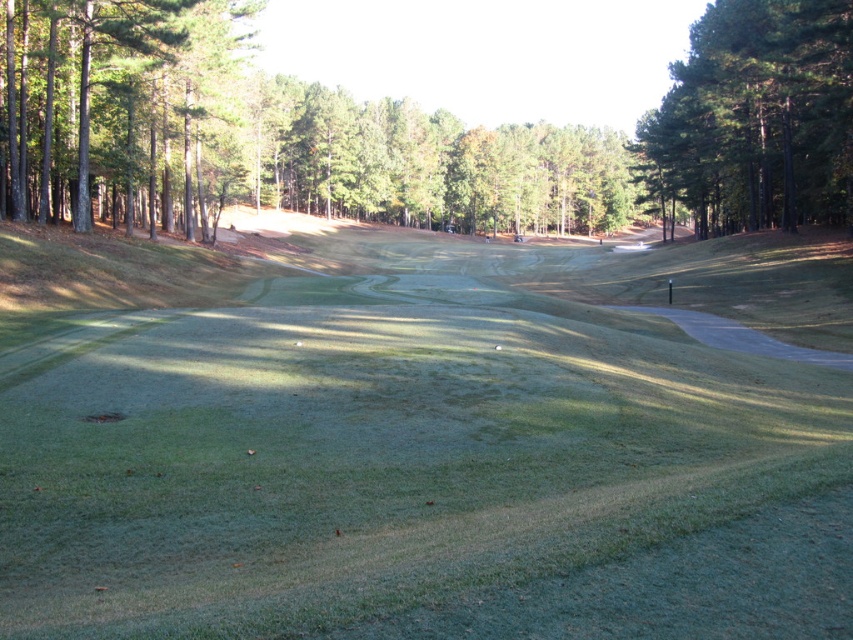
Question: Observing the image, what is the correct spatial positioning of green grassy field at center in reference to green textured tree at left?

Choices:
 (A) left
 (B) right

Answer: (B)

Question: Which point is closer to the camera?

Choices:
 (A) (39, 632)
 (B) (48, 88)
 (C) (838, 28)

Answer: (A)

Question: Among these points, which one is farthest from the camera?

Choices:
 (A) (42, 342)
 (B) (828, 90)
 (C) (13, 122)

Answer: (B)

Question: Is green grassy field at center to the right of green textured tree at left from the viewer's perspective?

Choices:
 (A) yes
 (B) no

Answer: (A)

Question: Is green grassy field at center wider than green textured tree at upper right?

Choices:
 (A) no
 (B) yes

Answer: (B)

Question: Which point is farther from the camera taking this photo?

Choices:
 (A) (614, 444)
 (B) (822, 138)
 (C) (177, 8)

Answer: (B)